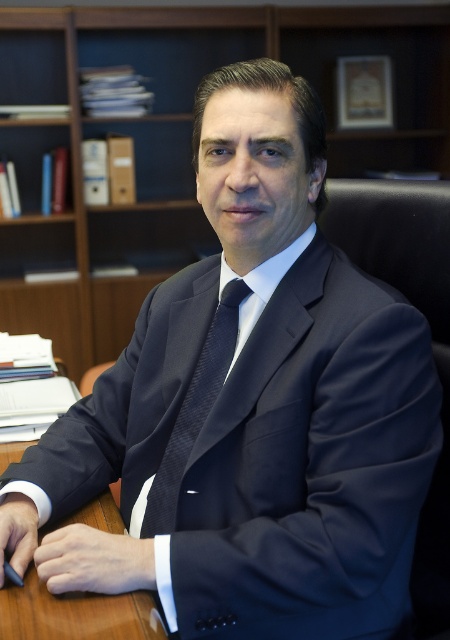
Question: Is brown wooden table at center to the left of navy blue textured tie at center from the viewer's perspective?

Choices:
 (A) yes
 (B) no

Answer: (A)

Question: Does wooden bookshelf at upper center have a lesser width compared to navy blue textured tie at center?

Choices:
 (A) no
 (B) yes

Answer: (A)

Question: Does wooden bookshelf at upper center come behind navy blue textured tie at center?

Choices:
 (A) no
 (B) yes

Answer: (B)

Question: Which of these objects is positioned closest to the wooden bookshelf at upper center?

Choices:
 (A) brown wooden table at center
 (B) navy blue textured tie at center

Answer: (B)

Question: Among these objects, which one is nearest to the camera?

Choices:
 (A) navy blue textured tie at center
 (B) wooden bookshelf at upper center

Answer: (A)

Question: Considering the real-world distances, which object is farthest from the navy blue textured tie at center?

Choices:
 (A) brown wooden table at center
 (B) wooden bookshelf at upper center

Answer: (B)